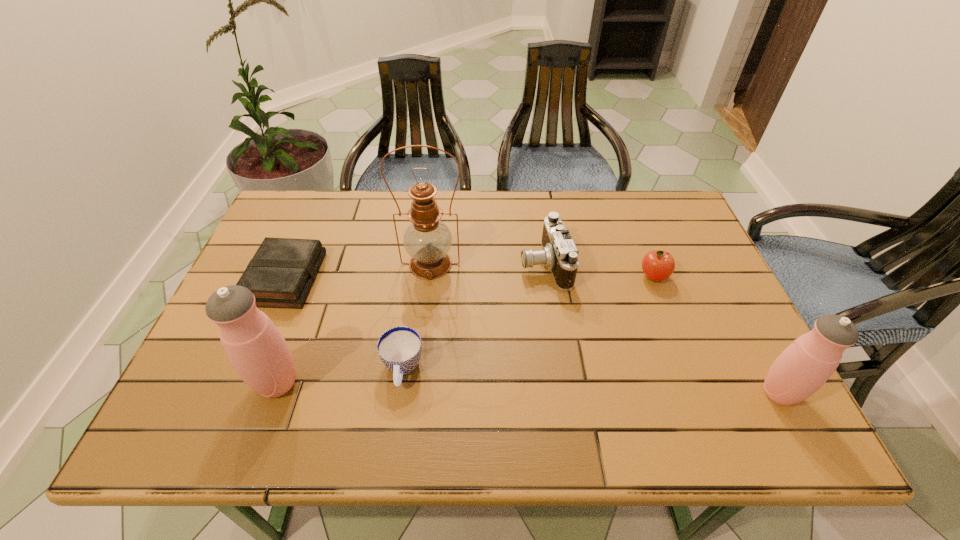
Find the location of a particular element. empty space between the tallest object and the right thermos bottle is located at coordinates (605, 329).

Find the location of a particular element. Image resolution: width=960 pixels, height=540 pixels. empty location between the book and the apple is located at coordinates (469, 278).

This screenshot has width=960, height=540. Find the location of `free space between the camera and the cup`. free space between the camera and the cup is located at coordinates click(473, 316).

Locate an element on the screen. This screenshot has width=960, height=540. free space between the taller thermos bottle and the third object from right to left is located at coordinates (411, 323).

Locate an element on the screen. This screenshot has height=540, width=960. free spot between the second shortest object and the camera is located at coordinates (473, 316).

The width and height of the screenshot is (960, 540). What are the coordinates of `free space between the book and the shorter thermos bottle` in the screenshot? It's located at (533, 336).

This screenshot has height=540, width=960. I want to click on vacant point located between the book and the taller thermos bottle, so click(282, 331).

Locate an element on the screen. Image resolution: width=960 pixels, height=540 pixels. free area in between the second tallest object and the book is located at coordinates (282, 331).

The image size is (960, 540). In order to click on vacant area that lies between the cup and the camera in this screenshot , I will do `click(473, 316)`.

What are the coordinates of `object that stands as the closest to the shortest object` in the screenshot? It's located at (256, 349).